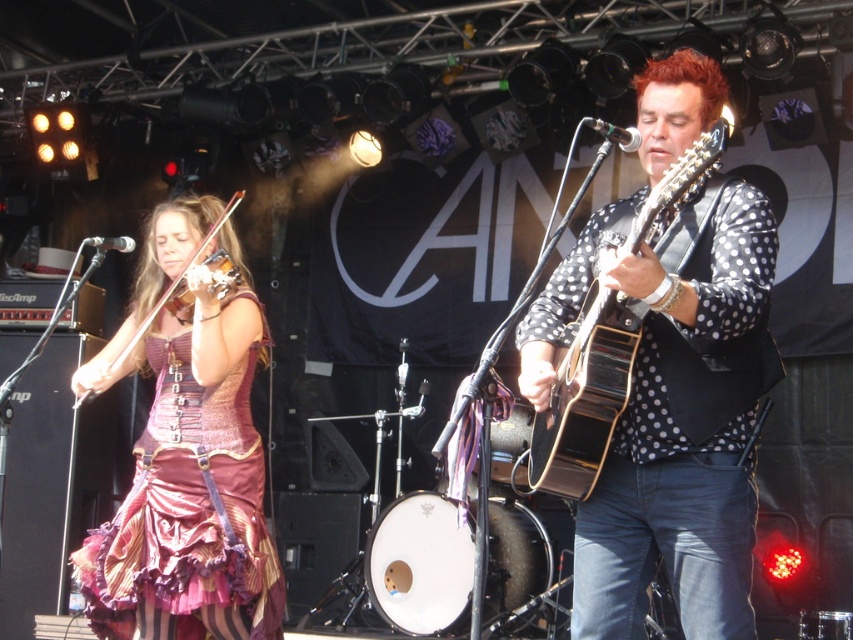
Can you confirm if shiny purple fabric dress at left is smaller than wooden acoustic guitar at center?

No, shiny purple fabric dress at left is not smaller than wooden acoustic guitar at center.

Is shiny purple fabric dress at left behind wooden acoustic guitar at center?

Yes.

Between point (219, 454) and point (663, 196), which one is positioned behind?

Point (219, 454)

In order to click on shiny purple fabric dress at left in this screenshot , I will do pos(189,515).

Which is in front, point (549, 442) or point (126, 353)?

Point (549, 442) is more forward.

Where is `wooden acoustic guitar at center`? wooden acoustic guitar at center is located at coordinates (585, 396).

Image resolution: width=853 pixels, height=640 pixels. I want to click on wooden acoustic guitar at center, so click(x=585, y=396).

Between shiny purple fabric dress at left and shiny purple violin at left, which one has more height?

shiny purple fabric dress at left is taller.

Does shiny purple fabric dress at left appear under shiny purple violin at left?

Yes, shiny purple fabric dress at left is below shiny purple violin at left.

I want to click on shiny purple fabric dress at left, so click(189, 515).